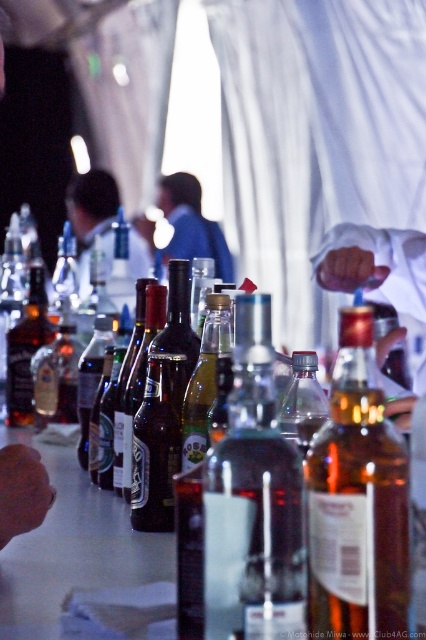
Question: Is clear glass bottle at center wider than matte brown bottle at center?

Choices:
 (A) no
 (B) yes

Answer: (A)

Question: Which point is farther to the camera?

Choices:
 (A) (83, 259)
 (B) (316, 362)
 (C) (190, 378)

Answer: (A)

Question: Which object is closer to the camera taking this photo?

Choices:
 (A) clear glass bottle at center
 (B) blue fabric shirt at center
 (C) translucent glass wine bottle at center

Answer: (C)

Question: Is blue fabric shirt at center bigger than clear plastic bottle at center?

Choices:
 (A) yes
 (B) no

Answer: (A)

Question: Is matte brown bottle at center smaller than clear plastic bottle at center?

Choices:
 (A) no
 (B) yes

Answer: (A)

Question: Which point is farther to the camera?

Choices:
 (A) clear plastic bottle at center
 (B) translucent glass bottle at center
 (C) matte black shirt at center

Answer: (C)